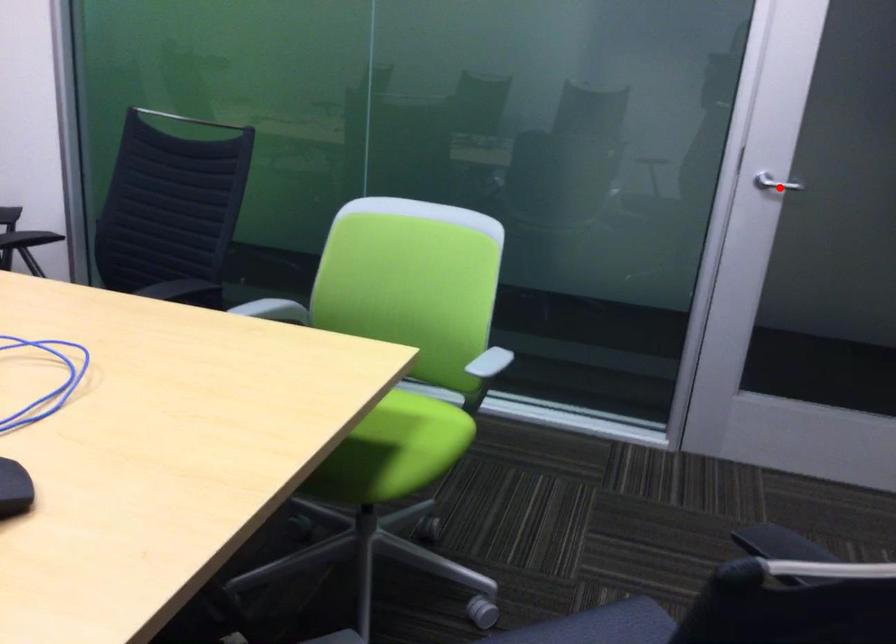
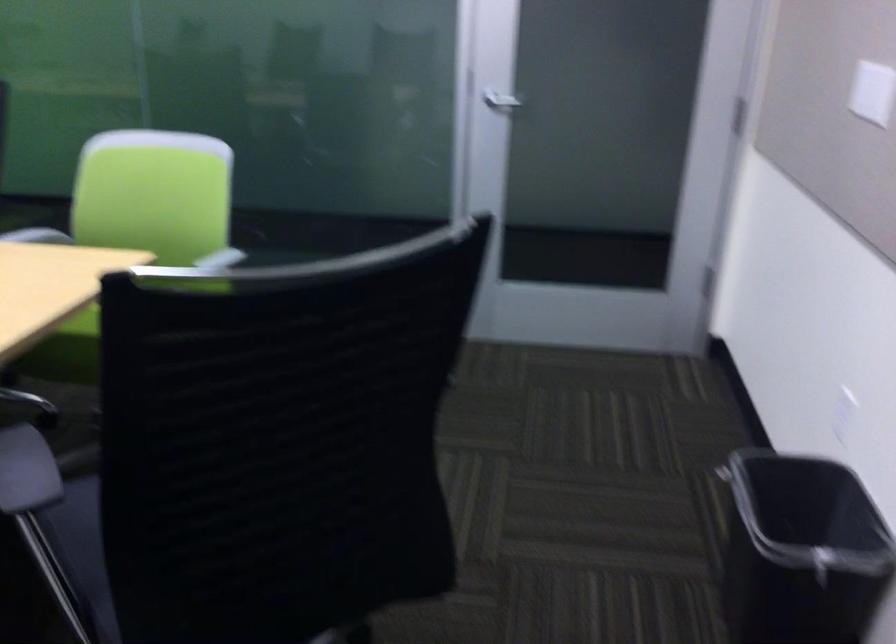
The point at the highlighted location is marked in the first image. Where is the corresponding point in the second image?

(501, 102)